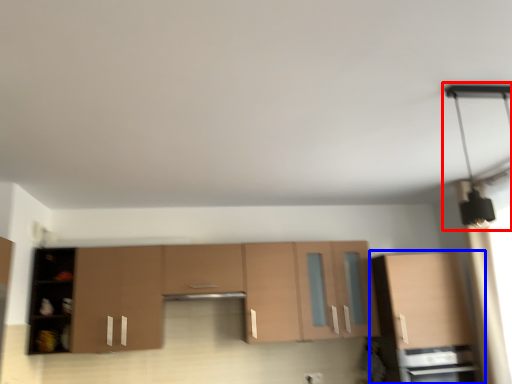
Question: Which of the following is the closest to the observer, light fixture (highlighted by a red box) or cabinetry (highlighted by a blue box)?

Choices:
 (A) light fixture
 (B) cabinetry

Answer: (A)